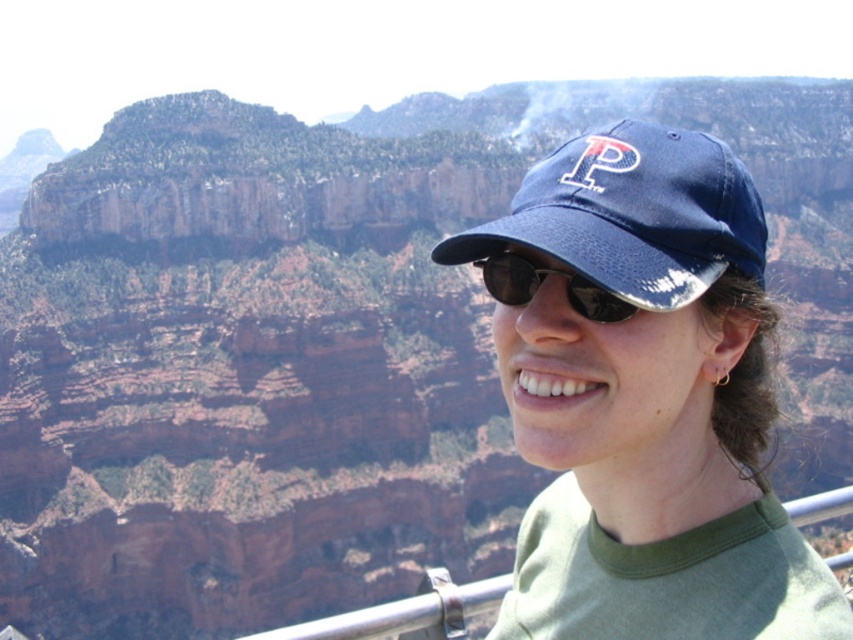
Between navy blue fabric baseball cap at upper center and sunglasses at center, which one has more height?

navy blue fabric baseball cap at upper center is taller.

Does navy blue fabric baseball cap at upper center appear on the left side of sunglasses at center?

Incorrect, navy blue fabric baseball cap at upper center is not on the left side of sunglasses at center.

Which is in front, point (572, 209) or point (621, 300)?

Positioned in front is point (572, 209).

The width and height of the screenshot is (853, 640). Identify the location of navy blue fabric baseball cap at upper center. (631, 214).

Can you confirm if blue fabric cap at center is positioned below sunglasses at center?

Yes, blue fabric cap at center is below sunglasses at center.

Can you confirm if blue fabric cap at center is wider than sunglasses at center?

Yes, blue fabric cap at center is wider than sunglasses at center.

Is point (537, 192) behind point (515, 256)?

That is False.

At what (x,y) coordinates should I click in order to perform the action: click on blue fabric cap at center. Please return your answer as a coordinate pair (x, y). Looking at the image, I should click on (643, 397).

Between blue fabric cap at center and navy blue fabric baseball cap at upper center, which one has more height?

Standing taller between the two is blue fabric cap at center.

The width and height of the screenshot is (853, 640). Describe the element at coordinates (643, 397) in the screenshot. I see `blue fabric cap at center` at that location.

Where is `blue fabric cap at center`? blue fabric cap at center is located at coordinates (643, 397).